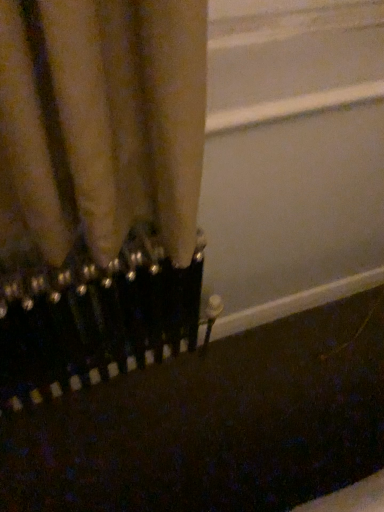
The width and height of the screenshot is (384, 512). What do you see at coordinates (94, 322) in the screenshot?
I see `metallic silver brush at lower left` at bounding box center [94, 322].

This screenshot has height=512, width=384. In order to click on metallic silver brush at lower left in this screenshot , I will do `click(94, 322)`.

Locate an element on the screen. metallic silver brush at lower left is located at coordinates (94, 322).